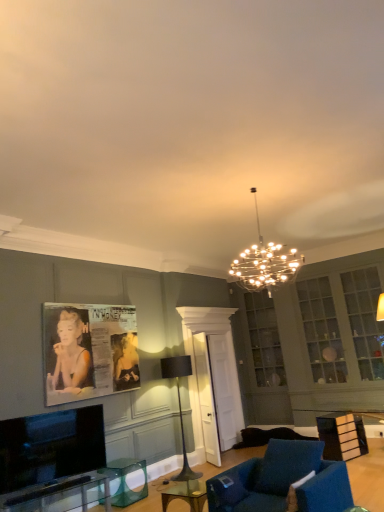
Identify the location of free location above metallic chandelier at center, the 1th lamp from the front (from a real-world perspective). This screenshot has width=384, height=512. (246, 187).